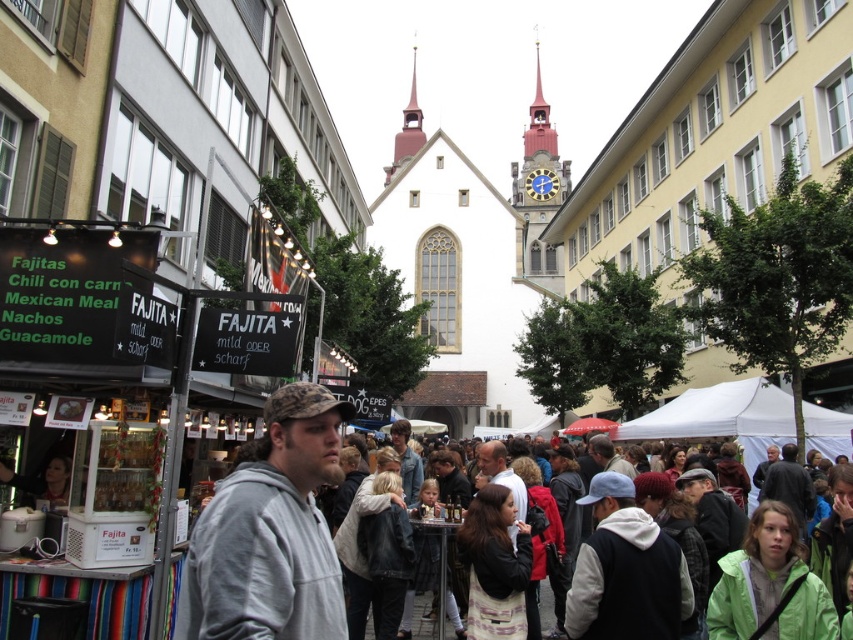
Question: Does white stone church at center appear on the left side of gray matte jacket at center?

Choices:
 (A) yes
 (B) no

Answer: (B)

Question: Is white stone church at center in front of gray matte jacket at center?

Choices:
 (A) yes
 (B) no

Answer: (B)

Question: Does white stone church at center have a larger size compared to gray matte jacket at center?

Choices:
 (A) yes
 (B) no

Answer: (A)

Question: Among these points, which one is nearest to the camera?

Choices:
 (A) (529, 129)
 (B) (229, 534)

Answer: (B)